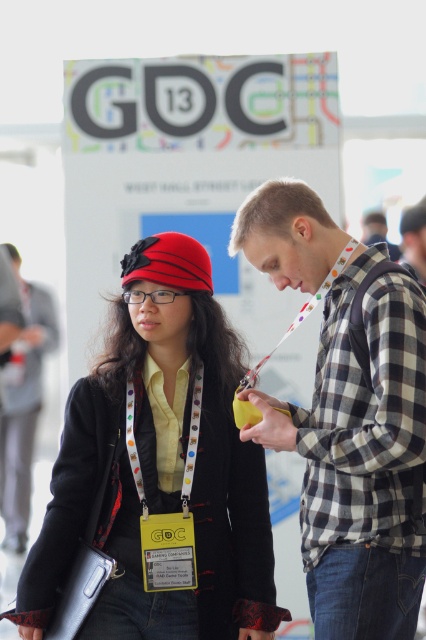
Can you confirm if matte black coat at center is thinner than matte black jacket at center?

Incorrect, matte black coat at center's width is not less than matte black jacket at center's.

Is matte black coat at center positioned behind matte black jacket at center?

No.

Does point (158, 378) come farther from viewer compared to point (14, 392)?

No, (158, 378) is in front of (14, 392).

Where is `matte black coat at center`? This screenshot has width=426, height=640. matte black coat at center is located at coordinates pos(160,468).

Who is lower down, checkered fabric shirt at center or yellow fabric lanyard at center?

yellow fabric lanyard at center

What do you see at coordinates (360, 460) in the screenshot?
I see `checkered fabric shirt at center` at bounding box center [360, 460].

This screenshot has width=426, height=640. In order to click on checkered fabric shirt at center in this screenshot , I will do `click(360, 460)`.

Does matte black jacket at center appear on the right side of yellow fabric lanyard at center?

Incorrect, matte black jacket at center is not on the right side of yellow fabric lanyard at center.

Which is more to the right, matte black jacket at center or yellow fabric lanyard at center?

From the viewer's perspective, yellow fabric lanyard at center appears more on the right side.

Is point (22, 452) less distant than point (126, 426)?

No, it is behind (126, 426).

Image resolution: width=426 pixels, height=640 pixels. I want to click on matte black jacket at center, so click(x=20, y=392).